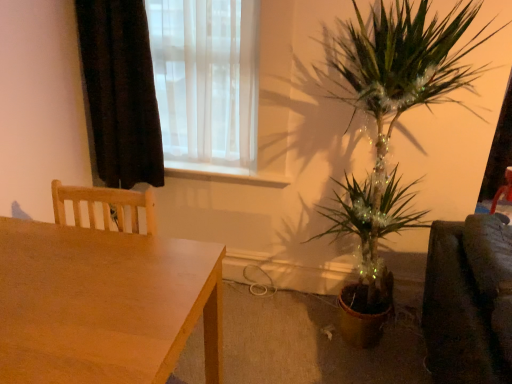
Question: Considering the relative positions of white glossy window sill at center and translucent white curtain at upper left in the image provided, is white glossy window sill at center to the left of translucent white curtain at upper left from the viewer's perspective?

Choices:
 (A) yes
 (B) no

Answer: (B)

Question: Is white glossy window sill at center facing towards translucent white curtain at upper left?

Choices:
 (A) yes
 (B) no

Answer: (B)

Question: Is translucent white curtain at upper left completely or partially inside white glossy window sill at center?

Choices:
 (A) no
 (B) yes

Answer: (A)

Question: Is white glossy window sill at center in contact with translucent white curtain at upper left?

Choices:
 (A) yes
 (B) no

Answer: (B)

Question: From the image's perspective, is white glossy window sill at center on translucent white curtain at upper left?

Choices:
 (A) no
 (B) yes

Answer: (A)

Question: Does white glossy window sill at center have a larger size compared to translucent white curtain at upper left?

Choices:
 (A) no
 (B) yes

Answer: (A)

Question: Is translucent white curtain at upper left shorter than wooden table at lower left?

Choices:
 (A) yes
 (B) no

Answer: (B)

Question: Does translucent white curtain at upper left appear on the left side of wooden table at lower left?

Choices:
 (A) yes
 (B) no

Answer: (B)

Question: Is translucent white curtain at upper left further to camera compared to wooden table at lower left?

Choices:
 (A) no
 (B) yes

Answer: (B)

Question: Does translucent white curtain at upper left have a smaller size compared to wooden table at lower left?

Choices:
 (A) no
 (B) yes

Answer: (B)

Question: Is translucent white curtain at upper left bigger than wooden table at lower left?

Choices:
 (A) yes
 (B) no

Answer: (B)

Question: Are translucent white curtain at upper left and wooden table at lower left making contact?

Choices:
 (A) no
 (B) yes

Answer: (A)

Question: Considering the relative sizes of wooden table at lower left and white glossy window sill at center in the image provided, is wooden table at lower left smaller than white glossy window sill at center?

Choices:
 (A) no
 (B) yes

Answer: (A)